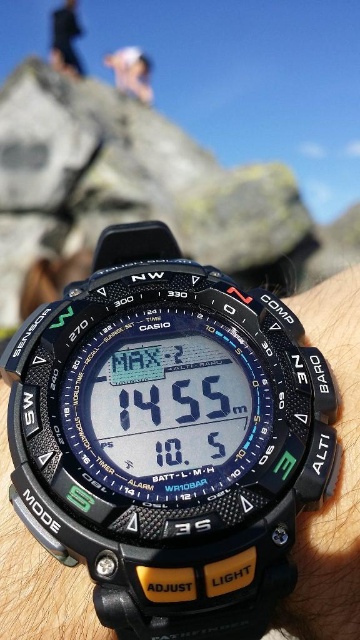
Is black rubber watch at lower right wider than white fabric person at upper center?

Yes, black rubber watch at lower right is wider than white fabric person at upper center.

Who is higher up, black rubber watch at lower right or white fabric person at upper center?

white fabric person at upper center is above.

The width and height of the screenshot is (360, 640). I want to click on black rubber watch at lower right, so click(x=338, y=480).

In the scene shown: Is black carbon fiber watch at center to the left of black rubber watch at lower right from the viewer's perspective?

Correct, you'll find black carbon fiber watch at center to the left of black rubber watch at lower right.

Between point (151, 416) and point (358, 456), which one is positioned behind?

The point (358, 456) is behind.

Which is behind, point (51, 355) or point (353, 600)?

Positioned behind is point (51, 355).

Image resolution: width=360 pixels, height=640 pixels. I want to click on black carbon fiber watch at center, so click(168, 438).

In the scene shown: Can you confirm if black carbon fiber watch at center is thinner than black fabric person at upper center?

No.

Is point (159, 337) positioned before point (69, 58)?

Yes, point (159, 337) is in front of point (69, 58).

What do you see at coordinates (168, 438) in the screenshot? I see `black carbon fiber watch at center` at bounding box center [168, 438].

You are a GUI agent. You are given a task and a screenshot of the screen. Output one action in this format:
    pyautogui.click(x=<x>, y=<y>)
    Task: Click on the black carbon fiber watch at center
    The image size is (360, 640).
    Given the screenshot: What is the action you would take?
    pyautogui.click(x=168, y=438)